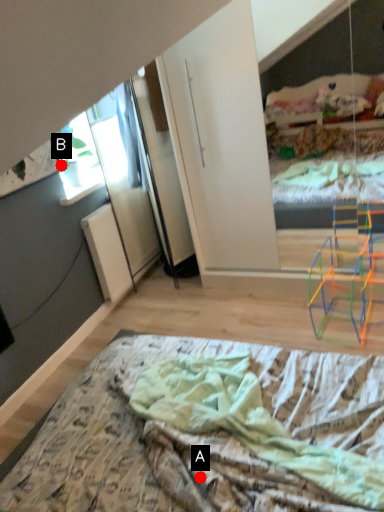
Question: Two points are circled on the image, labeled by A and B beside each circle. Which of the following is the closest to the observer?

Choices:
 (A) A is closer
 (B) B is closer

Answer: (A)